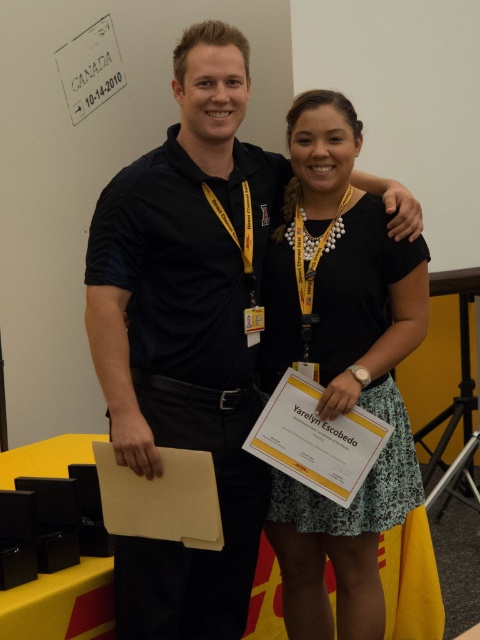
Between black matte shirt at upper left and black floral dress at center, which one is positioned higher?

black matte shirt at upper left is above.

Where is `black matte shirt at upper left`? The image size is (480, 640). black matte shirt at upper left is located at coordinates (186, 333).

Locate an element on the screen. The image size is (480, 640). black matte shirt at upper left is located at coordinates (186, 333).

This screenshot has width=480, height=640. In order to click on black matte shirt at upper left in this screenshot , I will do `click(186, 333)`.